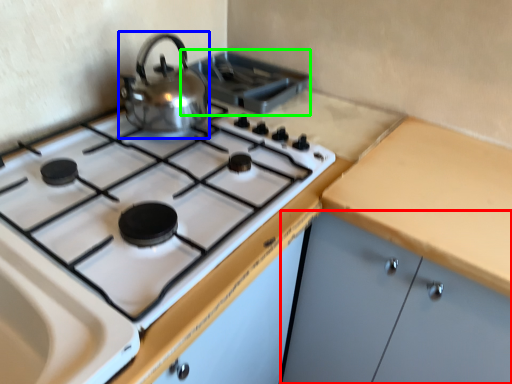
Question: Which is nearer to the cabinetry (highlighted by a red box)? kitchen appliance (highlighted by a blue box) or appliance (highlighted by a green box).

Choices:
 (A) kitchen appliance
 (B) appliance

Answer: (A)